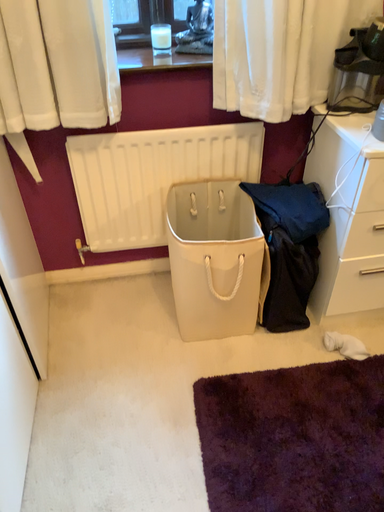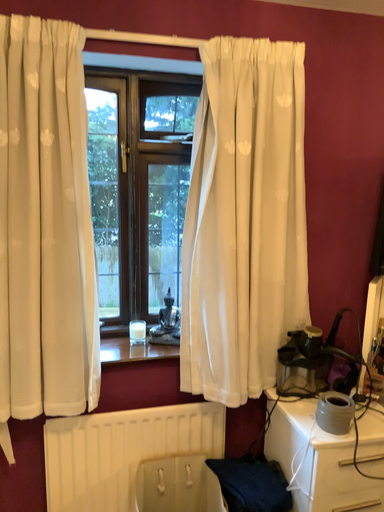
Question: How did the camera likely rotate when shooting the video?

Choices:
 (A) rotated downward
 (B) rotated upward

Answer: (B)